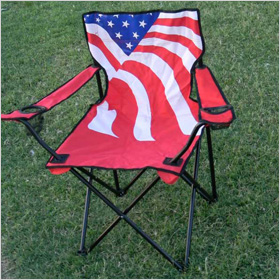
Find the location of a particular element. This screenshot has height=280, width=280. folding chair is located at coordinates (115, 155).